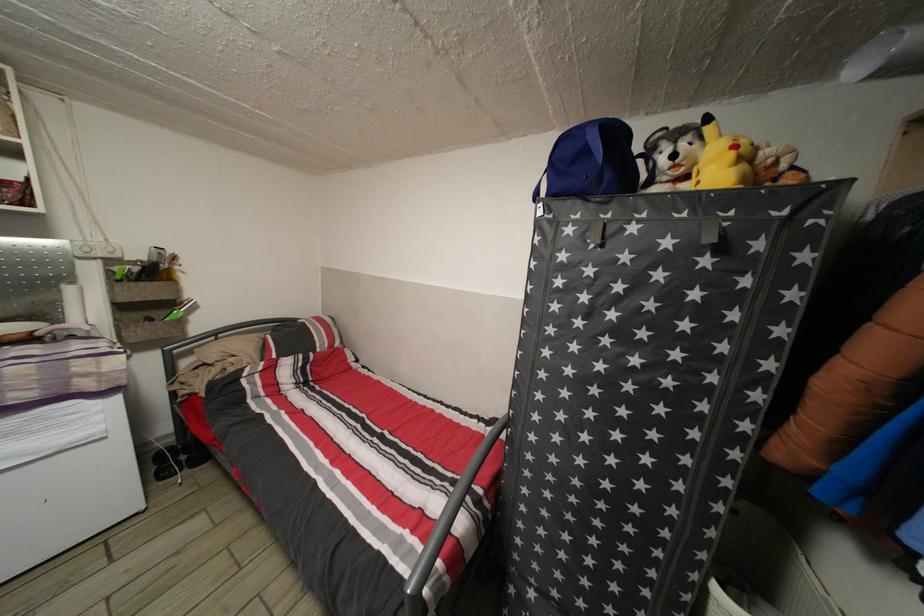
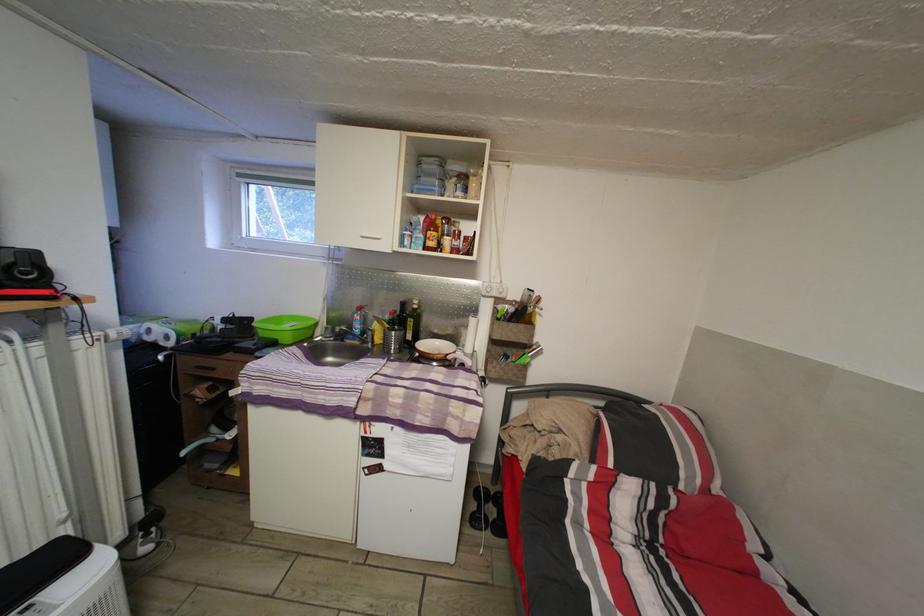
Question: The first image is from the beginning of the video and the second image is from the end. How did the camera likely rotate when shooting the video?

Choices:
 (A) Left
 (B) Right
 (C) Up
 (D) Down

Answer: (A)